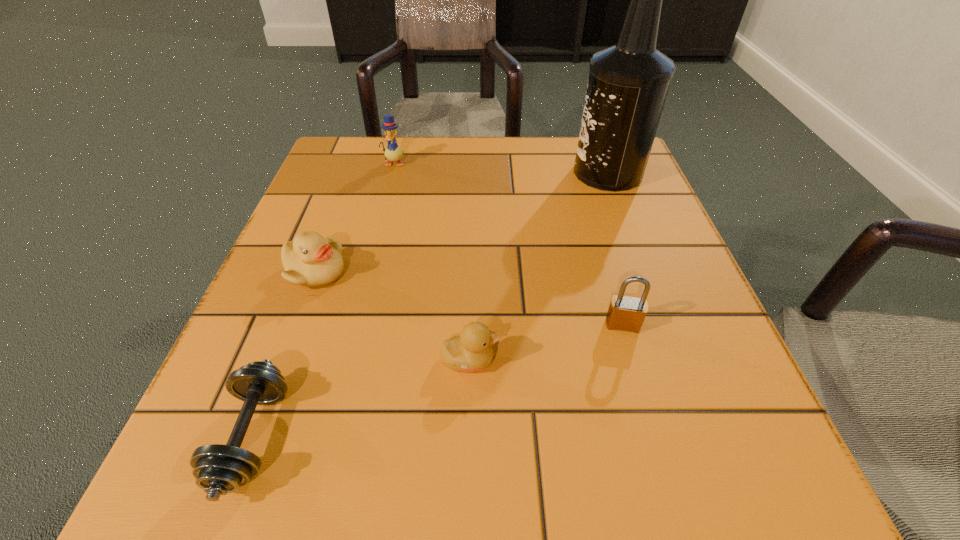
Where is `vacant space situated on the front label of the liquor`? This screenshot has height=540, width=960. vacant space situated on the front label of the liquor is located at coordinates (486, 173).

You are a GUI agent. You are given a task and a screenshot of the screen. Output one action in this format:
    pyautogui.click(x=<x>, y=<y>)
    Task: Click on the vacant space located 0.270m on the front label of the liquor
    Image resolution: width=960 pixels, height=540 pixels.
    Given the screenshot: What is the action you would take?
    pyautogui.click(x=449, y=173)

Where is `free point located on the face of the tallest duckling, where the monocle is placed`? This screenshot has height=540, width=960. free point located on the face of the tallest duckling, where the monocle is placed is located at coordinates (370, 256).

Identify the location of free region located 0.320m on the left of the fourth farthest object. The width and height of the screenshot is (960, 540). (394, 325).

The width and height of the screenshot is (960, 540). What are the coordinates of `vacant area situated on the beak of the second nearest duckling` in the screenshot? It's located at (464, 272).

Find the location of `vacant space situated 0.310m facing forward on the nearest duckling`. vacant space situated 0.310m facing forward on the nearest duckling is located at coordinates (719, 360).

This screenshot has height=540, width=960. Identify the location of vacant space situated 0.090m on the right of the dumbbell. (355, 437).

The image size is (960, 540). What are the coordinates of `liquor at the far edge` in the screenshot? It's located at (628, 83).

The height and width of the screenshot is (540, 960). What are the coordinates of `duckling that is at the far edge` in the screenshot? It's located at (392, 152).

At what (x,y) coordinates should I click in order to perform the action: click on object at the near edge. Please return your answer as a coordinate pair (x, y). Image resolution: width=960 pixels, height=540 pixels. Looking at the image, I should click on (219, 469).